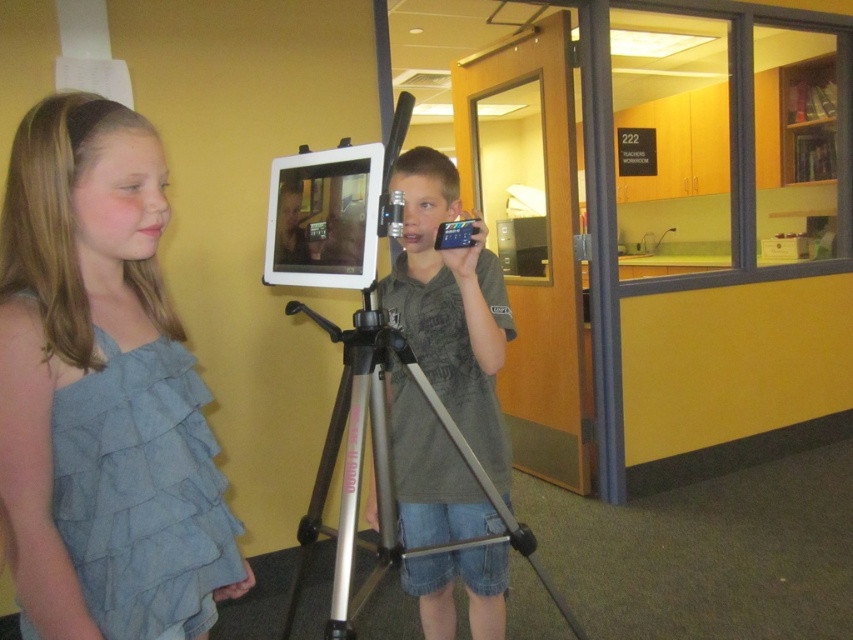
Question: Does gray cotton shirt at center have a lesser width compared to silver metallic tripod at center?

Choices:
 (A) yes
 (B) no

Answer: (A)

Question: Considering the real-world distances, which object is closest to the gray cotton shirt at center?

Choices:
 (A) denim ruffled top at left
 (B) silver metallic tripod at center

Answer: (B)

Question: Which point appears closest to the camera in this image?

Choices:
 (A) (364, 420)
 (B) (128, 316)

Answer: (B)

Question: Which object is closer to the camera taking this photo?

Choices:
 (A) gray cotton shirt at center
 (B) denim ruffled top at left
 (C) silver metallic tripod at center

Answer: (B)

Question: Does denim ruffled top at left appear on the right side of silver metallic tripod at center?

Choices:
 (A) no
 (B) yes

Answer: (A)

Question: Does denim ruffled top at left appear under gray cotton shirt at center?

Choices:
 (A) no
 (B) yes

Answer: (A)